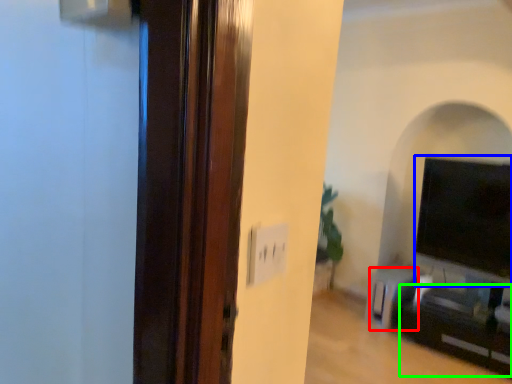
Question: Based on their relative distances, which object is farther from furniture (highlighted by a red box)? Choose from wide (highlighted by a blue box) and entertainment center (highlighted by a green box).

Choices:
 (A) wide
 (B) entertainment center

Answer: (A)